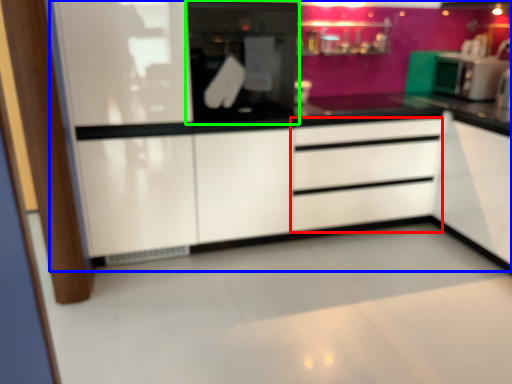
Question: Which object is positioned closest to drawer (highlighted by a red box)? Select from dresser (highlighted by a blue box) and home appliance (highlighted by a green box).

Choices:
 (A) dresser
 (B) home appliance

Answer: (A)